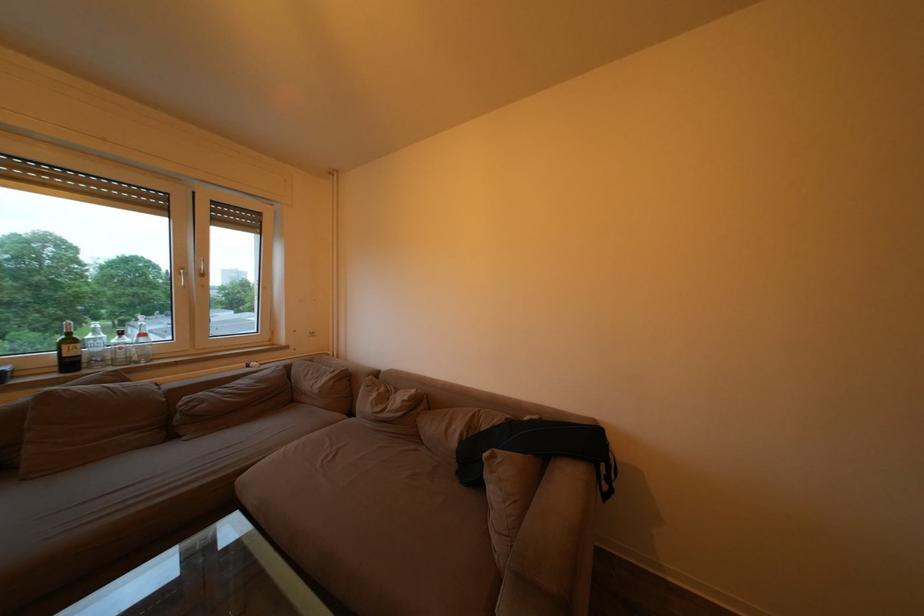
The width and height of the screenshot is (924, 616). I want to click on dark wine bottle, so click(68, 350).